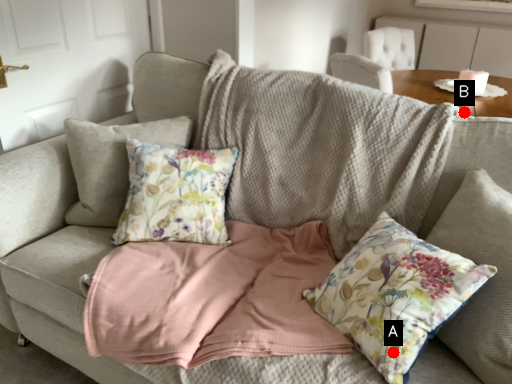
Question: Two points are circled on the image, labeled by A and B beside each circle. Which point appears closest to the camera in this image?

Choices:
 (A) A is closer
 (B) B is closer

Answer: (A)